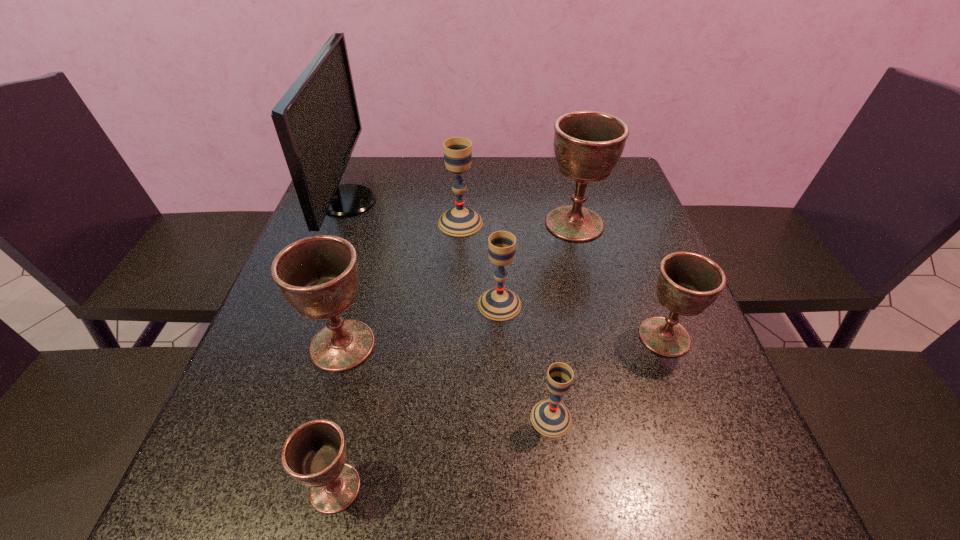
Identify the location of the fifth closest object to the second smallest gray chalice. (687, 283).

Select which object appears as the seventh closest to the nearest gray chalice. Please provide its 2D coordinates. Your answer should be formatted as a tuple, i.e. [(x, y)], where the tuple contains the x and y coordinates of a point satisfying the conditions above.

[(317, 121)]

Identify the location of chalice that stands as the third closest to the biggest gray chalice. (318, 275).

Where is `the second closest chalice to the biggest brown chalice`? the second closest chalice to the biggest brown chalice is located at coordinates (500, 304).

In order to click on brown chalice that stands as the second closest to the computer monitor in this screenshot , I will do tap(587, 144).

Where is `the third closest brown chalice to the third smallest brown chalice`? This screenshot has height=540, width=960. the third closest brown chalice to the third smallest brown chalice is located at coordinates (687, 283).

Select which gray chalice appears as the third closest to the smallest brown chalice. Please provide its 2D coordinates. Your answer should be formatted as a tuple, i.e. [(x, y)], where the tuple contains the x and y coordinates of a point satisfying the conditions above.

[(459, 221)]

Identify the location of the second closest gray chalice to the third biggest brown chalice. (500, 304).

Find the location of `vacant position in the image that satisfies the following two spatial constraints: 1. on the front-facing side of the tallest chalice; 2. on the right side of the black computer monitor`. vacant position in the image that satisfies the following two spatial constraints: 1. on the front-facing side of the tallest chalice; 2. on the right side of the black computer monitor is located at coordinates (340, 224).

You are a GUI agent. You are given a task and a screenshot of the screen. Output one action in this format:
    pyautogui.click(x=<x>, y=<y>)
    Task: Click on the vacant space that satisfies the following two spatial constraints: 1. on the front side of the second biggest brown chalice; 2. on the left side of the seventh farthest object
    The image size is (960, 540).
    Given the screenshot: What is the action you would take?
    pyautogui.click(x=323, y=418)